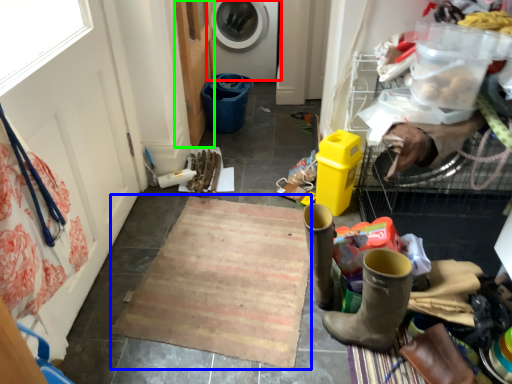
Question: Based on their relative distances, which object is nearer to washing machine (highlighted by a red box)? Choose from doormat (highlighted by a blue box) and screen door (highlighted by a green box).

Choices:
 (A) doormat
 (B) screen door

Answer: (B)